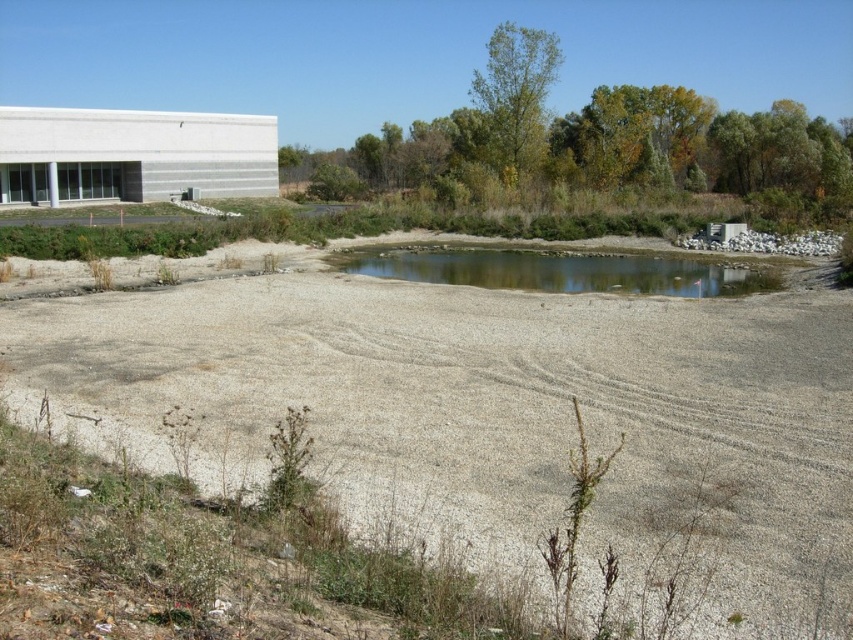
Question: Can you confirm if gray gravel field at center is bigger than clear water at center?

Choices:
 (A) yes
 (B) no

Answer: (A)

Question: Is gray gravel field at center wider than clear water at center?

Choices:
 (A) no
 (B) yes

Answer: (B)

Question: Which point is farther to the camera?

Choices:
 (A) (134, 368)
 (B) (514, 276)

Answer: (B)

Question: Can you confirm if gray gravel field at center is positioned to the right of clear water at center?

Choices:
 (A) no
 (B) yes

Answer: (A)

Question: Which object appears farthest from the camera in this image?

Choices:
 (A) gray gravel field at center
 (B) clear water at center

Answer: (B)